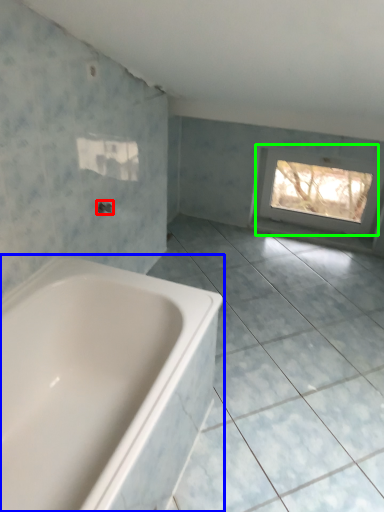
Question: Which object is positioned farthest from tap (highlighted by a red box)? Select from bathtub (highlighted by a blue box) and window (highlighted by a green box).

Choices:
 (A) bathtub
 (B) window

Answer: (B)